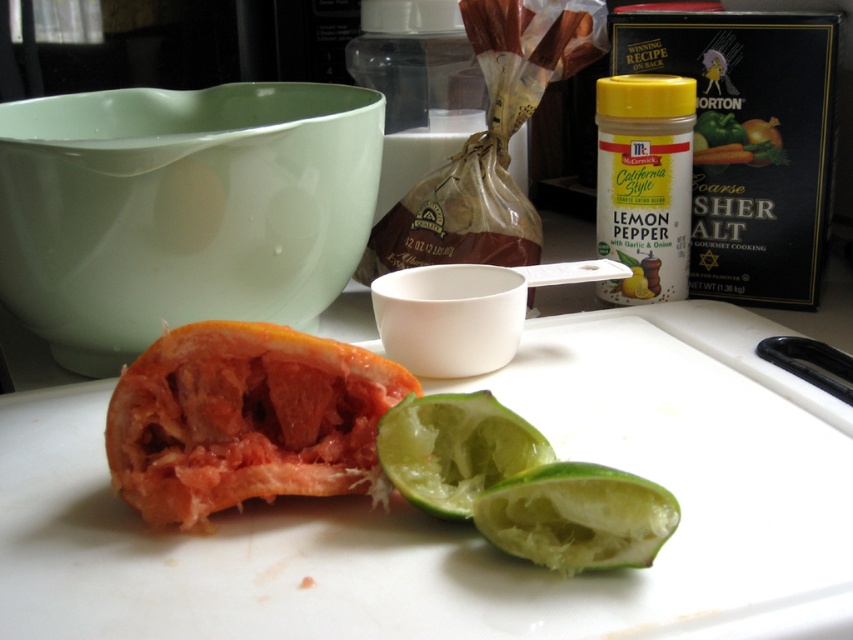
You are standing in the kitchen and see two points on the countertop. The first point is at position point (x=619, y=557) and the second point is at position point (x=462, y=424). Which point is closer to you?

The point at position point (x=619, y=557) is closer to you because it is closer to the camera than point (x=462, y=424).

You are organizing the kitchen items. The yellow plastic container at upper right needs to be placed exactly at point 0.5, 0.5. Can you move it there without moving any other items?

The yellow plastic container at upper right is currently at point (643, 182), so moving it to (426, 320) would require shifting it to the right and down. However, since there are other items in the way, it might not be possible without moving them first.

You are preparing a drink and need to choose the larger lime between the green matte lime at lower center and the green matte lime at center. Which one should you pick?

The green matte lime at center is larger than the green matte lime at lower center, so you should pick the green matte lime at center.